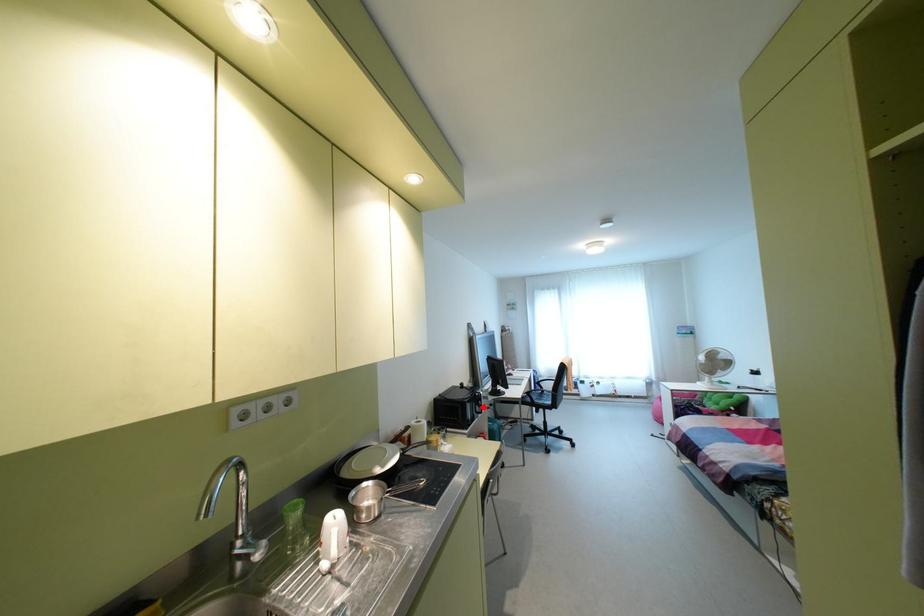
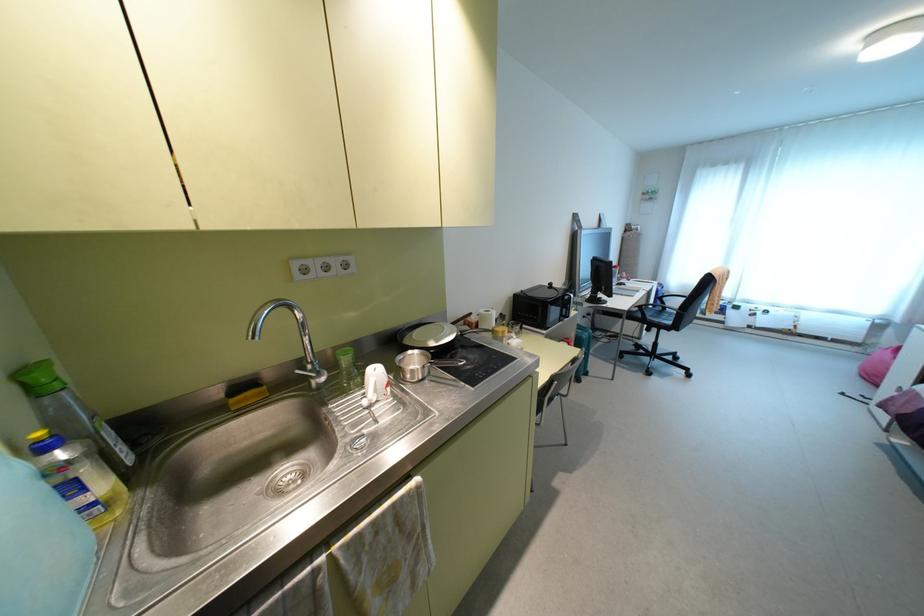
In the second image, find the point that corresponds to the highlighted location in the first image.

(573, 313)